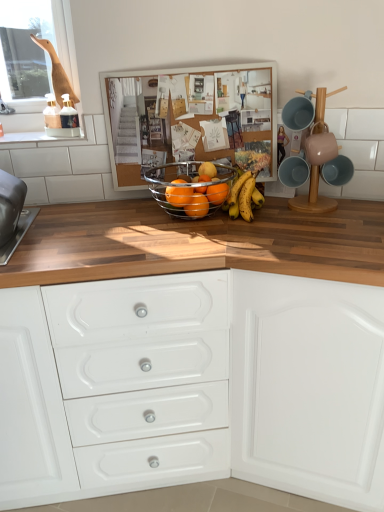
At what (x,y) coordinates should I click in order to perform the action: click on vacant area on top of white glossy chest of drawers at center (from a real-world perspective). Please return your answer as a coordinate pair (x, y). The image size is (384, 512). Looking at the image, I should click on (121, 229).